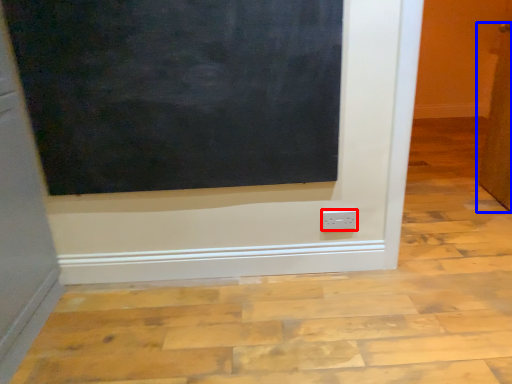
Question: Which object is closer to the camera taking this photo, power plugs and sockets (highlighted by a red box) or door (highlighted by a blue box)?

Choices:
 (A) power plugs and sockets
 (B) door

Answer: (A)